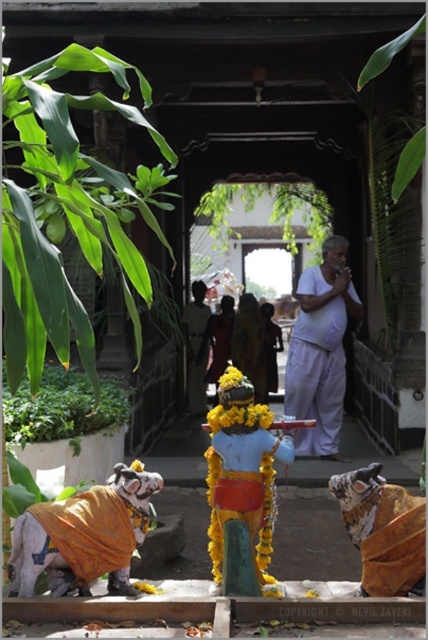
Question: Does yellow fabric clothed dog at lower left come in front of yellow fabric garland at center?

Choices:
 (A) no
 (B) yes

Answer: (B)

Question: Can you confirm if white cotton monk at center is positioned to the right of yellow fabric tiger at lower right?

Choices:
 (A) yes
 (B) no

Answer: (A)

Question: Which is farther from the yellow fabric clothed dog at lower left?

Choices:
 (A) yellow fabric garland at center
 (B) dark brown fabric at center
 (C) yellow fabric tiger at lower right

Answer: (B)

Question: Is yellow fabric clothed dog at lower left above white cotton monk at center?

Choices:
 (A) no
 (B) yes

Answer: (A)

Question: Which object appears farthest from the camera in this image?

Choices:
 (A) yellow fabric garland at center
 (B) white cotton monk at center
 (C) dark brown fabric at center

Answer: (C)

Question: Among these points, which one is nearest to the camera?

Choices:
 (A) (397, 531)
 (B) (243, 330)
 (C) (323, 332)
 (D) (115, 586)

Answer: (A)